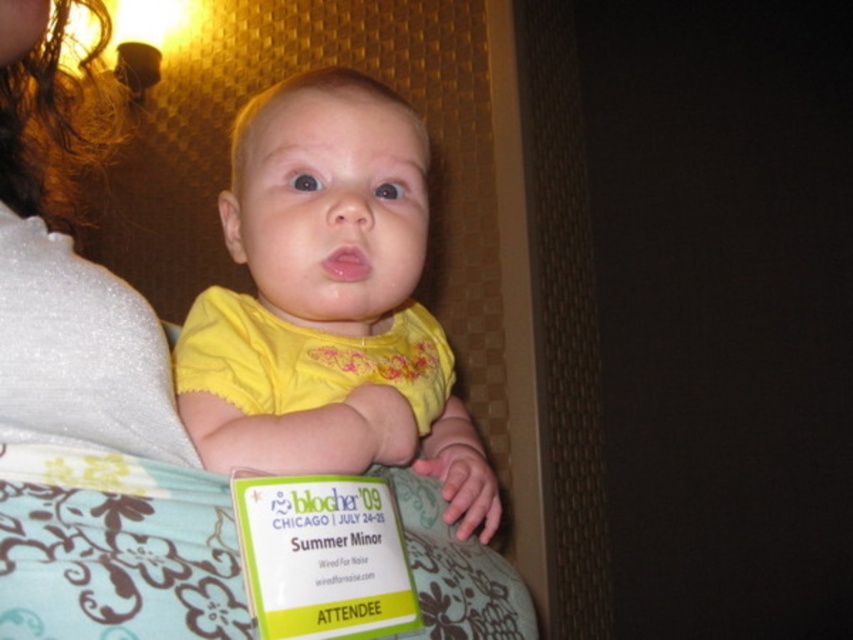
You are holding a toy that is 12 inches long. If you want to hand it to the yellow fabric baby at center, can you reach it without moving closer?

The yellow fabric baby at center is 18.34 inches away from the viewer. Since the toy is only 12 inches long, you cannot reach the yellow fabric baby at center without moving closer.

Based on the scene description, can you determine the position of the yellow fabric baby at center relative to the white sparkly fabric at upper left?

The yellow fabric baby at center is to the right of the white sparkly fabric at upper left.

You are a photographer taking a picture of the baby. You notice two points in the image, one at coordinates point (460, 426) and another at point (132, 564). Which point is closer to the camera?

Point (460, 426) is further to the viewer than point (132, 564), so the point closer to the camera is point (132, 564).